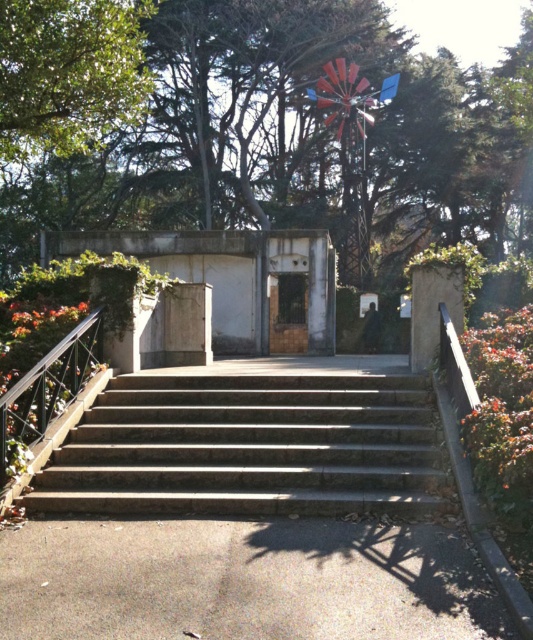
Question: Which object is farther from the camera taking this photo?

Choices:
 (A) wooden door at center
 (B) slate stone stairs at center

Answer: (A)

Question: Which of the following is the farthest from the observer?

Choices:
 (A) (117, 490)
 (B) (282, 332)

Answer: (B)

Question: Is slate stone stairs at center below wooden door at center?

Choices:
 (A) no
 (B) yes

Answer: (B)

Question: Is slate stone stairs at center below wooden door at center?

Choices:
 (A) no
 (B) yes

Answer: (B)

Question: Does slate stone stairs at center have a lesser width compared to wooden door at center?

Choices:
 (A) yes
 (B) no

Answer: (B)